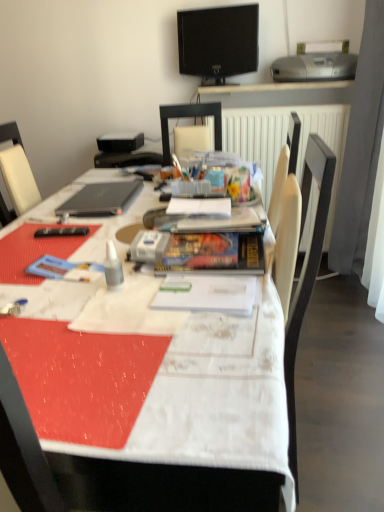
Describe the element at coordinates (218, 42) in the screenshot. The height and width of the screenshot is (512, 384). I see `black glossy tv at upper center` at that location.

Where is `silver metallic printer at upper right`? The image size is (384, 512). silver metallic printer at upper right is located at coordinates (316, 63).

This screenshot has width=384, height=512. I want to click on white textured tablecloth at center, so click(x=212, y=403).

Where is `hardcover book at center, the 2th paperback book when ordered from back to front`? hardcover book at center, the 2th paperback book when ordered from back to front is located at coordinates (213, 253).

What do you see at coordinates (200, 207) in the screenshot? I see `hardcover book at center, which appears as the 2th paperback book when viewed from the front` at bounding box center [200, 207].

Where is `black glossy tv at upper center`? black glossy tv at upper center is located at coordinates (218, 42).

Looking at this image, considering the relative sizes of black glossy tv at upper center and white textured tablecloth at center in the image provided, is black glossy tv at upper center shorter than white textured tablecloth at center?

Yes, black glossy tv at upper center is shorter than white textured tablecloth at center.

Would you say black glossy tv at upper center is to the left or to the right of white textured tablecloth at center in the picture?

From the image, it's evident that black glossy tv at upper center is to the right of white textured tablecloth at center.

Based on the photo, is black glossy tv at upper center oriented away from white textured tablecloth at center?

No, white textured tablecloth at center is not at the back of black glossy tv at upper center.

Is there a large distance between black glossy tv at upper center and white textured tablecloth at center?

Yes.

Based on their sizes in the image, would you say hardcover book at center, the 2th paperback book when ordered from back to front, is bigger or smaller than white textured tablecloth at center?

hardcover book at center, the 2th paperback book when ordered from back to front, is smaller than white textured tablecloth at center.

How many degrees apart are the facing directions of hardcover book at center, which is the 1th paperback book from front to back, and white textured tablecloth at center?

1.54 degrees.

In the scene shown: In the image, is hardcover book at center, marked as the 1th paperback book in a bottom-to-top arrangement, positioned in front of or behind white textured tablecloth at center?

In the image, hardcover book at center, marked as the 1th paperback book in a bottom-to-top arrangement, appears behind white textured tablecloth at center.

In terms of width, does hardcover book at center, which is the 1th paperback book from front to back, look wider or thinner when compared to white textured tablecloth at center?

In the image, hardcover book at center, which is the 1th paperback book from front to back, appears to be more narrow than white textured tablecloth at center.

Is silver metallic printer at upper right far away from sleek black laptop at upper left?

Yes, silver metallic printer at upper right and sleek black laptop at upper left are quite far apart.

Can you confirm if silver metallic printer at upper right is shorter than sleek black laptop at upper left?

No, silver metallic printer at upper right is not shorter than sleek black laptop at upper left.

Which object is positioned more to the right, silver metallic printer at upper right or sleek black laptop at upper left?

Positioned to the right is silver metallic printer at upper right.

From a real-world perspective, relative to matte black chair at center, is sleek black laptop at upper left vertically above or below?

sleek black laptop at upper left is below matte black chair at center.

In the scene shown: Between sleek black laptop at upper left and matte black chair at center, which one has smaller size?

With smaller size is sleek black laptop at upper left.

In the image, is sleek black laptop at upper left on the left side or the right side of matte black chair at center?

sleek black laptop at upper left is to the left of matte black chair at center.

You are a GUI agent. You are given a task and a screenshot of the screen. Output one action in this format:
    pyautogui.click(x=<x>, y=<y>)
    Task: Click on the chair behind the sleek black laptop at upper left
    
    Given the screenshot: What is the action you would take?
    pyautogui.click(x=189, y=117)

From a real-world perspective, which object stands above the other?

In real-world perspective, matte black chair at center is above.

In order to click on chair that appears on the left of hardcover book at center, which is the 1th paperback book from front to back in this screenshot , I will do `click(189, 117)`.

Who is bigger, matte black chair at center or hardcover book at center, which is the 1th paperback book from front to back?

With larger size is matte black chair at center.

How many degrees apart are the facing directions of matte black chair at center and hardcover book at center, the 2th paperback book when ordered from back to front?

They differ by 4.37 degrees in their facing directions.

From a real-world perspective, is white textured tablecloth at center positioned under hardcover book at center, which is the second paperback book in bottom-to-top order, based on gravity?

Yes, from a real-world perspective, white textured tablecloth at center is under hardcover book at center, which is the second paperback book in bottom-to-top order.

Which of these two, white textured tablecloth at center or hardcover book at center, marked as the 1th paperback book in a back-to-front arrangement, is smaller?

With smaller size is hardcover book at center, marked as the 1th paperback book in a back-to-front arrangement.

Find the location of `desk on the left of hardcover book at center, marked as the 1th paperback book in a back-to-front arrangement`. desk on the left of hardcover book at center, marked as the 1th paperback book in a back-to-front arrangement is located at coordinates (212, 403).

Are sleek black laptop at upper left and hardcover book at center, marked as the 1th paperback book in a back-to-front arrangement, far apart?

No, sleek black laptop at upper left is in close proximity to hardcover book at center, marked as the 1th paperback book in a back-to-front arrangement.

From the image's perspective, which is above, sleek black laptop at upper left or hardcover book at center, which appears as the 2th paperback book when viewed from the front?

sleek black laptop at upper left appears higher in the image.

Would you say sleek black laptop at upper left is inside or outside hardcover book at center, the 1th paperback book in the top-to-bottom sequence?

sleek black laptop at upper left is outside hardcover book at center, the 1th paperback book in the top-to-bottom sequence.

Is sleek black laptop at upper left taller than hardcover book at center, the 1th paperback book in the top-to-bottom sequence?

No, sleek black laptop at upper left is not taller than hardcover book at center, the 1th paperback book in the top-to-bottom sequence.

Find the location of a particular element. television lying behind the white textured tablecloth at center is located at coordinates (218, 42).

Where is `the 1st paperback book above the white textured tablecloth at center (from the image's perspective)`? the 1st paperback book above the white textured tablecloth at center (from the image's perspective) is located at coordinates (213, 253).

Estimate the real-world distances between objects in this image. Which object is closer to matte black chair at center, hardcover book at center, which is the second paperback book in bottom-to-top order, or clear plastic bottle at center?

hardcover book at center, which is the second paperback book in bottom-to-top order.

Looking at the image, which one is located further to white textured tablecloth at center, hardcover book at center, marked as the 1th paperback book in a back-to-front arrangement, or black glossy tv at upper center?

black glossy tv at upper center.

Which object lies further to the anchor point matte black chair at center, black glossy tv at upper center or hardcover book at center, the 2th paperback book when ordered from back to front?

hardcover book at center, the 2th paperback book when ordered from back to front, lies further to matte black chair at center than the other object.

Based on their spatial positions, is sleek black laptop at upper left or clear plastic bottle at center further from hardcover book at center, the 2th paperback book when ordered from top to bottom?

Based on the image, sleek black laptop at upper left appears to be further to hardcover book at center, the 2th paperback book when ordered from top to bottom.

Looking at the image, which one is located further to clear plastic bottle at center, matte black chair at center or hardcover book at center, marked as the 1th paperback book in a bottom-to-top arrangement?

matte black chair at center lies further to clear plastic bottle at center than the other object.

When comparing their distances from matte black chair at center, does hardcover book at center, which appears as the 2th paperback book when viewed from the front, or white textured tablecloth at center seem closer?

hardcover book at center, which appears as the 2th paperback book when viewed from the front, lies closer to matte black chair at center than the other object.

Considering their positions, is clear plastic bottle at center positioned closer to matte black chair at center than white textured tablecloth at center?

clear plastic bottle at center is closer to matte black chair at center.

Based on their spatial positions, is sleek black laptop at upper left or matte black chair at center closer to hardcover book at center, marked as the 1th paperback book in a bottom-to-top arrangement?

sleek black laptop at upper left is closer to hardcover book at center, marked as the 1th paperback book in a bottom-to-top arrangement.

The width and height of the screenshot is (384, 512). Find the location of `paperback book between hardcover book at center, the 2th paperback book when ordered from top to bottom, and sleek black laptop at upper left, along the z-axis`. paperback book between hardcover book at center, the 2th paperback book when ordered from top to bottom, and sleek black laptop at upper left, along the z-axis is located at coordinates point(200,207).

Locate an element on the screen. chair between hardcover book at center, the 2th paperback book when ordered from top to bottom, and black glossy tv at upper center, along the z-axis is located at coordinates (189, 117).

You are a GUI agent. You are given a task and a screenshot of the screen. Output one action in this format:
    pyautogui.click(x=<x>, y=<y>)
    Task: Click on the chair between black glossy tv at upper center and hardcover book at center, marked as the 1th paperback book in a back-to-front arrangement, vertically
    This screenshot has height=512, width=384.
    Given the screenshot: What is the action you would take?
    pyautogui.click(x=189, y=117)

Identify the location of paperback book between hardcover book at center, the 2th paperback book when ordered from back to front, and silver metallic printer at upper right, along the z-axis. (200, 207).